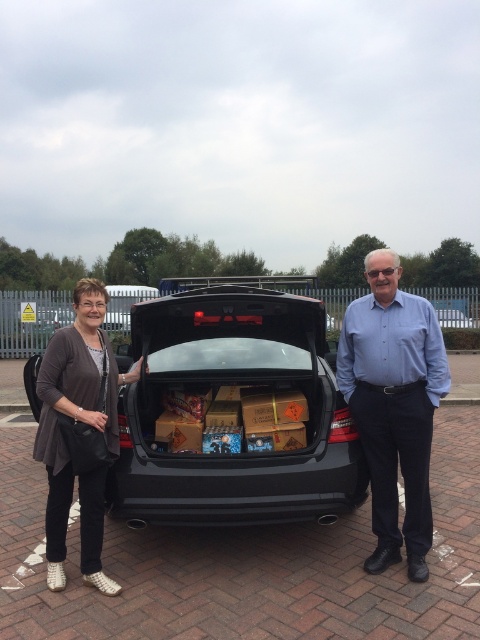
Question: Which object is positioned closest to the dark gray sweater at left?

Choices:
 (A) black matte car trunk at center
 (B) matte black car at center

Answer: (A)

Question: Does black matte car trunk at center have a greater width compared to blue shirt at center?

Choices:
 (A) yes
 (B) no

Answer: (A)

Question: Among these objects, which one is nearest to the camera?

Choices:
 (A) blue shirt at center
 (B) matte black car at center
 (C) dark gray sweater at left
 (D) black matte car trunk at center

Answer: (C)

Question: Considering the relative positions of matte black car at center and black matte car trunk at center in the image provided, where is matte black car at center located with respect to black matte car trunk at center?

Choices:
 (A) below
 (B) above

Answer: (B)

Question: Among these points, which one is farthest from the camera?

Choices:
 (A) (369, 380)
 (B) (132, 339)
 (C) (48, 531)

Answer: (B)

Question: Can you confirm if black matte car trunk at center is wider than blue shirt at center?

Choices:
 (A) no
 (B) yes

Answer: (B)